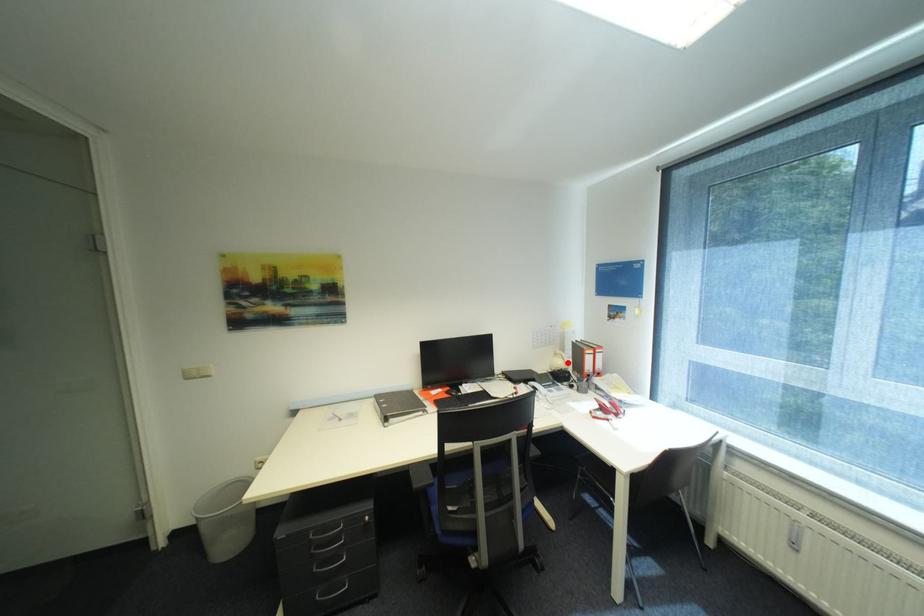
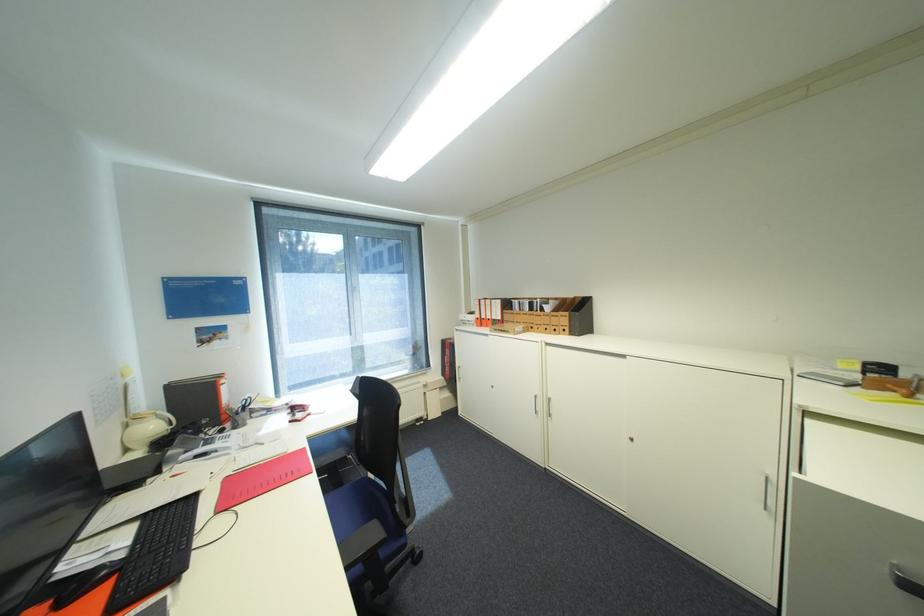
Question: I am providing you with two images of the same scene from different viewpoints. Given a red point in image1, look at the same physical point in image2. Is it:

Choices:
 (A) Closer to the viewpoint
 (B) Farther from the viewpoint

Answer: (A)